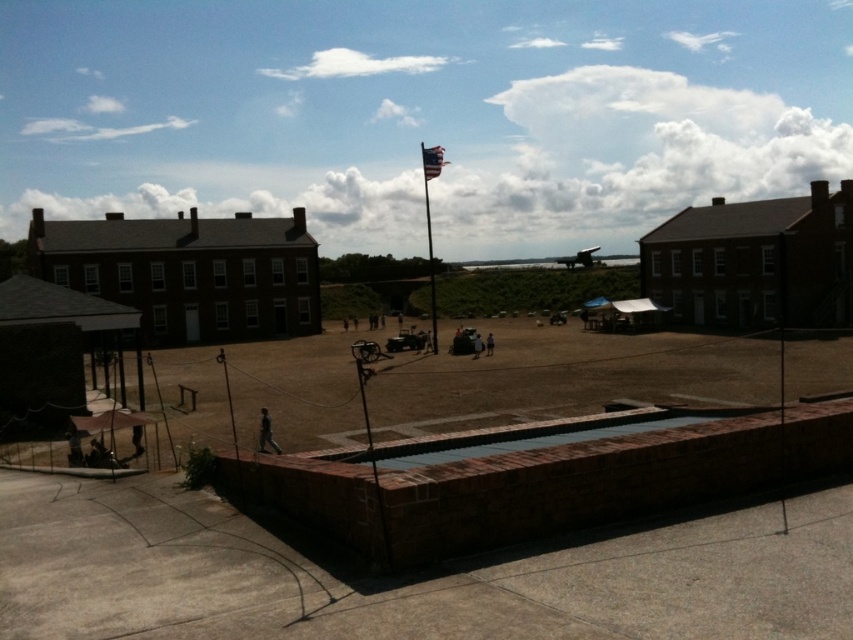
You are a visitor at the historical site and want to take a photo of the metallic flagpole at upper center. To avoid including the brown dirt field at center in your photo, where should you position yourself relative to the flagpole?

To avoid including the brown dirt field at center in your photo, you should position yourself behind the metallic flagpole at upper center since the brown dirt field at center is positioned under it.

You are a photographer planning to take a panoramic shot of the historical site. You need to ensure that both the brown dirt field at center and the metallic flagpole at upper center are fully visible in the frame. Based on their relative widths, which object should you prioritize positioning closer to the center of your camera viewfinder to avoid cropping?

The brown dirt field at center might be wider than the metallic flagpole at upper center, so prioritizing the brown dirt field at center near the center of the camera viewfinder would help ensure both fit without cropping.